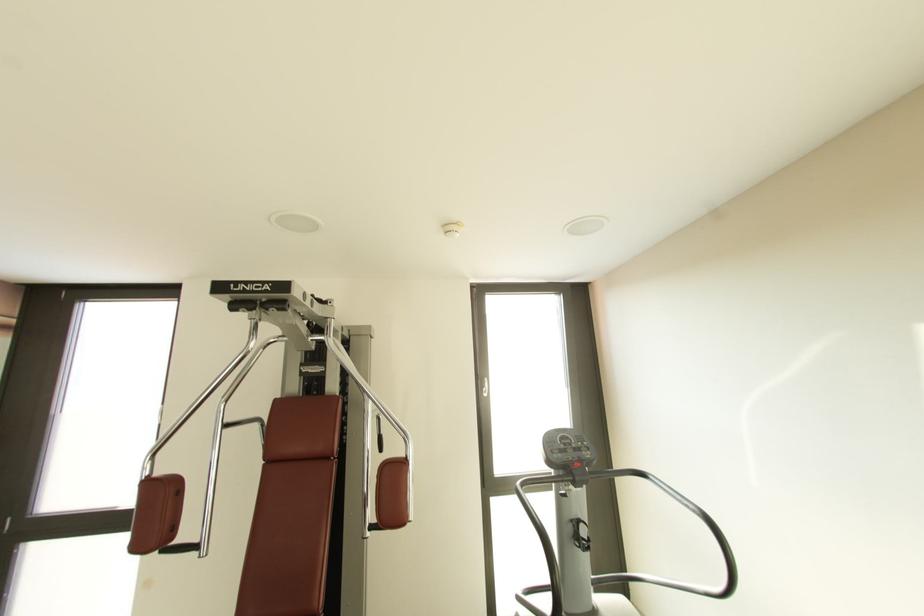
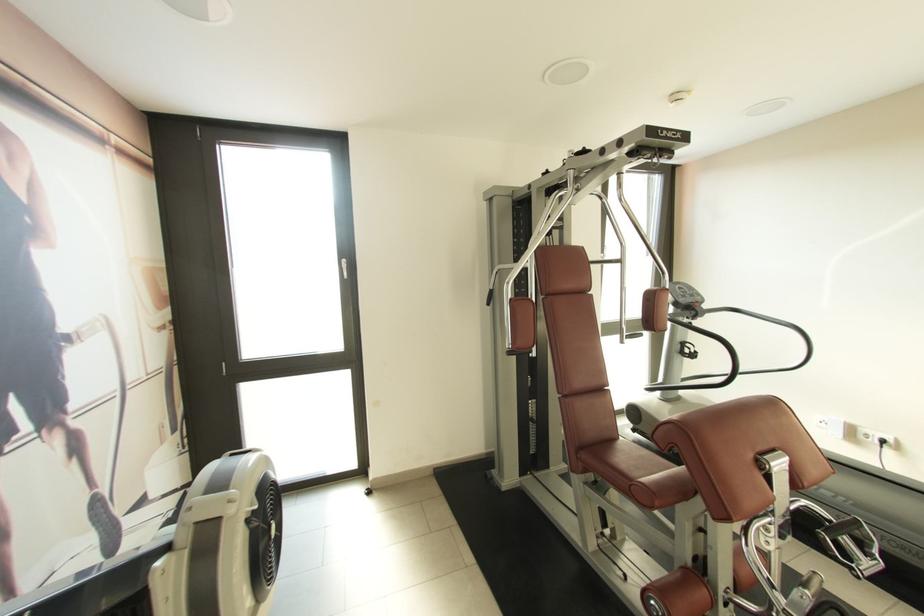
Question: Which direction would the cameraman need to move to produce the second image? Reply with the corresponding letter.

Choices:
 (A) Left
 (B) Right
 (C) Forward
 (D) Backward

Answer: (A)